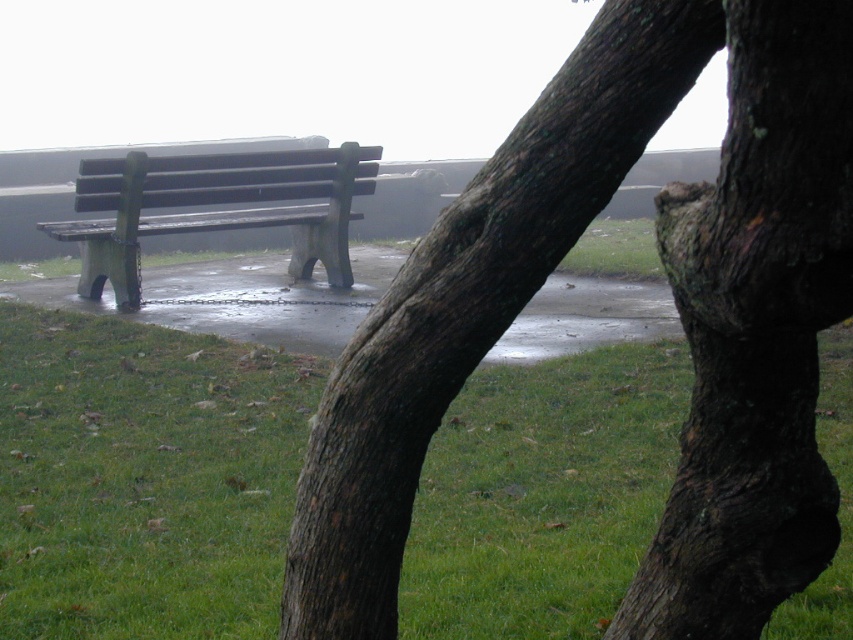
Is dark brown textured bark at center below wooden bench at left?

Yes, dark brown textured bark at center is below wooden bench at left.

Can you confirm if dark brown textured bark at center is shorter than wooden bench at left?

Yes.

Locate an element on the screen. dark brown textured bark at center is located at coordinates (674, 301).

Identify the location of dark brown textured bark at center. This screenshot has height=640, width=853. (674, 301).

Which of these two, dark brown textured bark at center or green grass at lower center, stands shorter?

With less height is green grass at lower center.

Can you confirm if dark brown textured bark at center is bigger than green grass at lower center?

Actually, dark brown textured bark at center might be smaller than green grass at lower center.

This screenshot has height=640, width=853. What do you see at coordinates (674, 301) in the screenshot?
I see `dark brown textured bark at center` at bounding box center [674, 301].

The image size is (853, 640). What are the coordinates of `dark brown textured bark at center` in the screenshot? It's located at (x=674, y=301).

Who is taller, green grass at lower center or wooden bench at left?

Standing taller between the two is wooden bench at left.

Is green grass at lower center shorter than wooden bench at left?

Indeed, green grass at lower center has a lesser height compared to wooden bench at left.

Identify the location of green grass at lower center. 143,477.

You are a GUI agent. You are given a task and a screenshot of the screen. Output one action in this format:
    pyautogui.click(x=<x>, y=<y>)
    Task: Click on the green grass at lower center
    The image size is (853, 640).
    Given the screenshot: What is the action you would take?
    pyautogui.click(x=143, y=477)